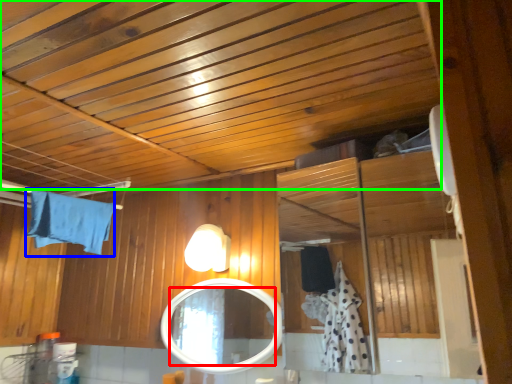
Question: Which object is positioned farthest from mirror (highlighted by a red box)? Select from bath towel (highlighted by a blue box) and exhaust hood (highlighted by a green box).

Choices:
 (A) bath towel
 (B) exhaust hood

Answer: (B)